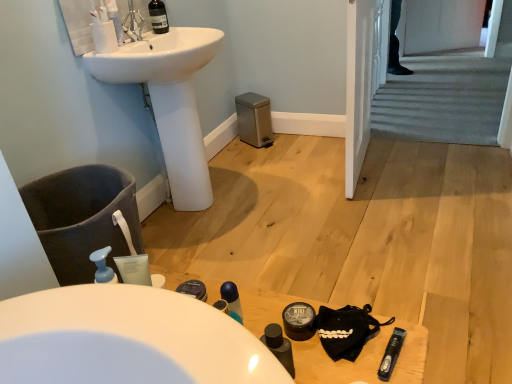
Image resolution: width=512 pixels, height=384 pixels. Find the location of `free space between transparent plastic mouthwash at lower right, marked as the first mouthwash in a front-to-back arrangement, and blue plastic mouthwash at center, placed as the second mouthwash when sorted from bottom to top`. free space between transparent plastic mouthwash at lower right, marked as the first mouthwash in a front-to-back arrangement, and blue plastic mouthwash at center, placed as the second mouthwash when sorted from bottom to top is located at coordinates (332, 335).